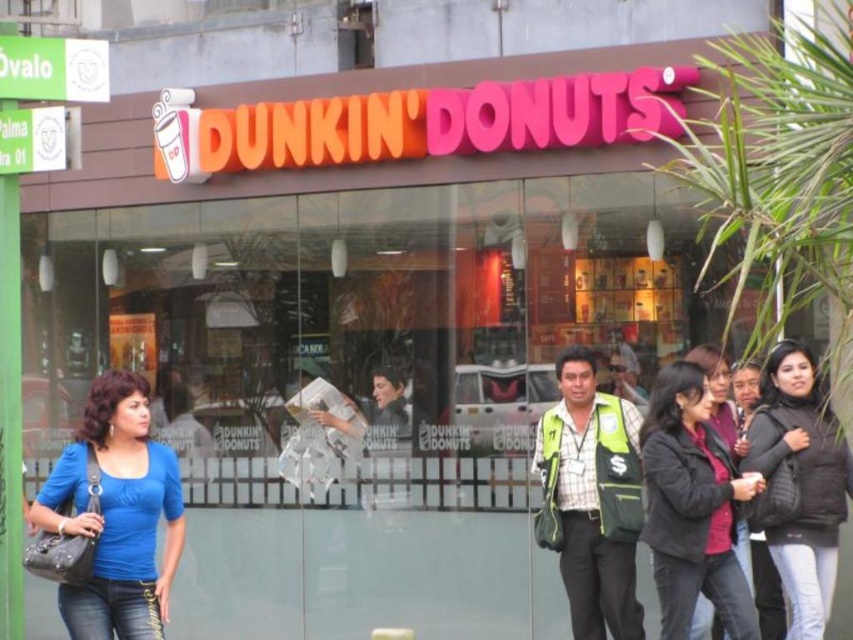
Who is lower down, blue fabric shirt at lower left or black matte jacket at lower right?

black matte jacket at lower right is lower down.

Does point (131, 592) come farther from viewer compared to point (809, 372)?

No, it is not.

I want to click on blue fabric shirt at lower left, so click(x=115, y=513).

Does smooth concrete pavement at lower center come in front of dark brown leather jacket at center?

No, smooth concrete pavement at lower center is further to the viewer.

Is smooth concrete pavement at lower center above dark brown leather jacket at center?

No.

Which is in front, point (375, 573) or point (703, 410)?

Point (703, 410)

Locate an element on the screen. smooth concrete pavement at lower center is located at coordinates (364, 576).

Does dark brown leather jacket at center appear on the right side of black matte jacket at lower right?

No, dark brown leather jacket at center is not to the right of black matte jacket at lower right.

Does dark brown leather jacket at center have a smaller size compared to black matte jacket at lower right?

Correct, dark brown leather jacket at center occupies less space than black matte jacket at lower right.

Looking at this image, measure the distance between point [695,520] and camera.

The distance of point [695,520] from camera is 6.11 meters.

Locate an element on the screen. The width and height of the screenshot is (853, 640). dark brown leather jacket at center is located at coordinates (692, 508).